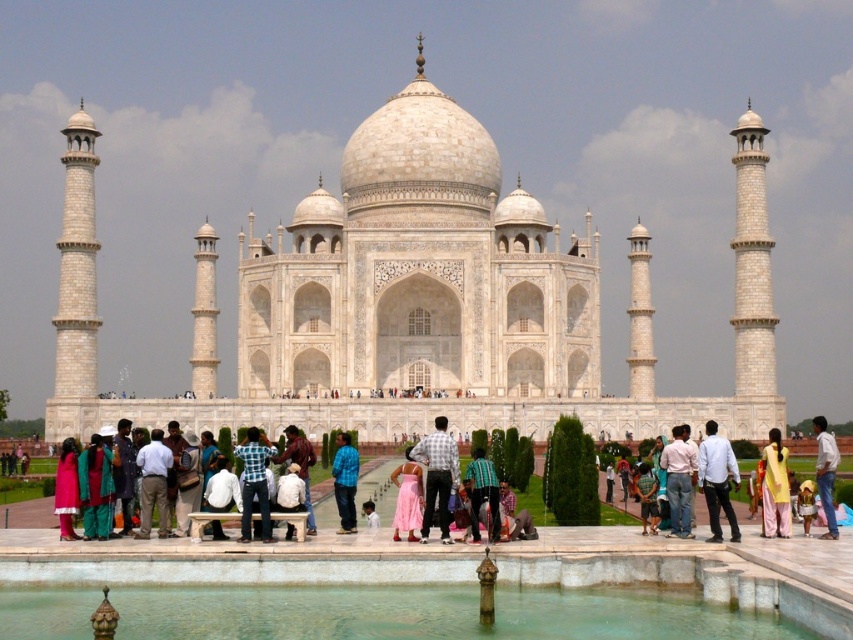
Question: Which object appears farthest from the camera in this image?

Choices:
 (A) checkered fabric shirt at center
 (B) light brown fabric shirt at lower right
 (C) light pink fabric at center

Answer: (C)

Question: Considering the relative positions of green checkered shirt at center and pink satin dress at center in the image provided, where is green checkered shirt at center located with respect to pink satin dress at center?

Choices:
 (A) below
 (B) above

Answer: (B)

Question: Does clear glass pool at center appear on the left side of matte brown shirt at center?

Choices:
 (A) yes
 (B) no

Answer: (B)

Question: Is green checkered shirt at center closer to camera compared to pink fabric at center?

Choices:
 (A) no
 (B) yes

Answer: (B)

Question: Which point is farther to the camera?

Choices:
 (A) (428, 467)
 (B) (148, 477)
 (C) (824, 490)

Answer: (A)

Question: Which point is closer to the camera?

Choices:
 (A) green checkered shirt at center
 (B) light pink fabric at center
 (C) matte brown shirt at center

Answer: (A)